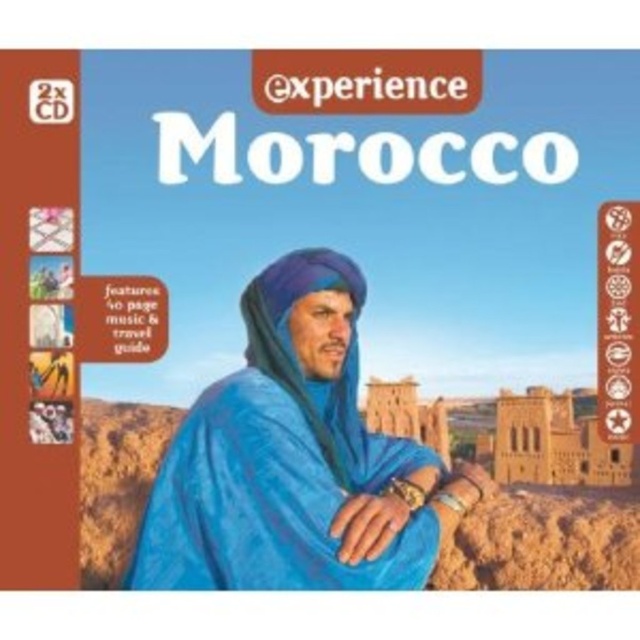
Based on the scene description, which object is positioned lower on the cover between the blue velvet robe at center and the blue fabric headscarf at center?

The blue velvet robe at center is positioned lower than the blue fabric headscarf at center according to the description.